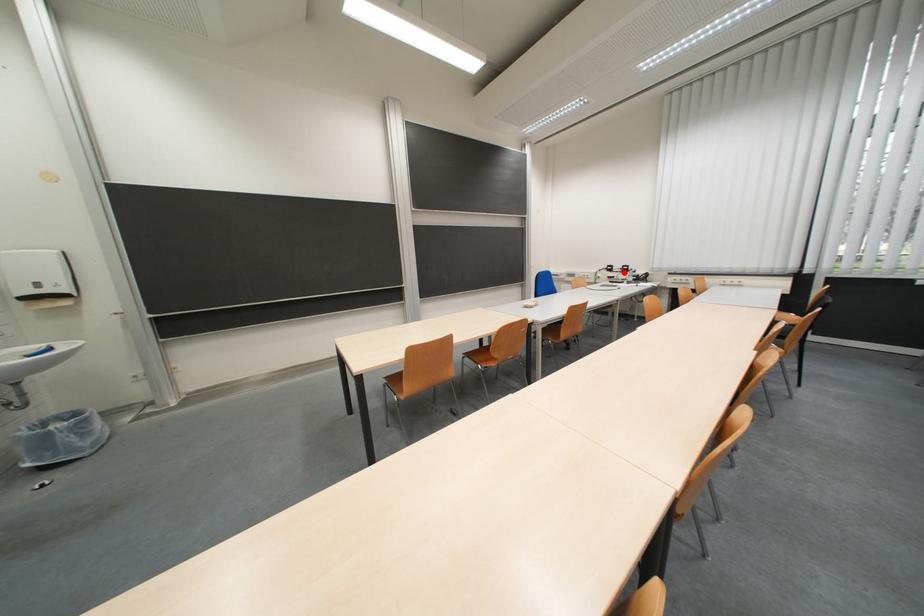
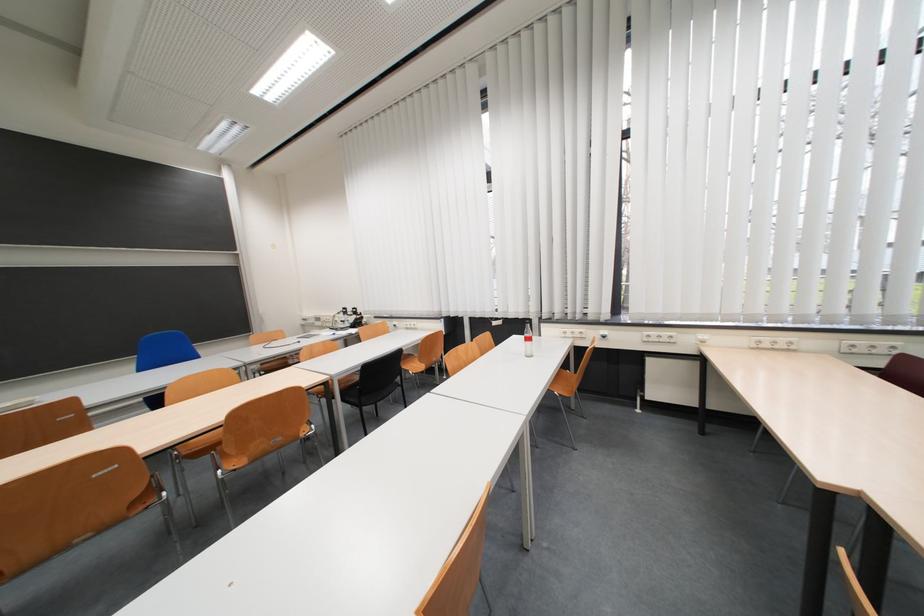
Question: I am providing you with two images of the same scene from different viewpoints. Image1 has a red point marked. In image2, the corresponding 3D location appears at what relative position? Reply with the corresponding letter.

Choices:
 (A) Closer
 (B) Farther

Answer: (B)